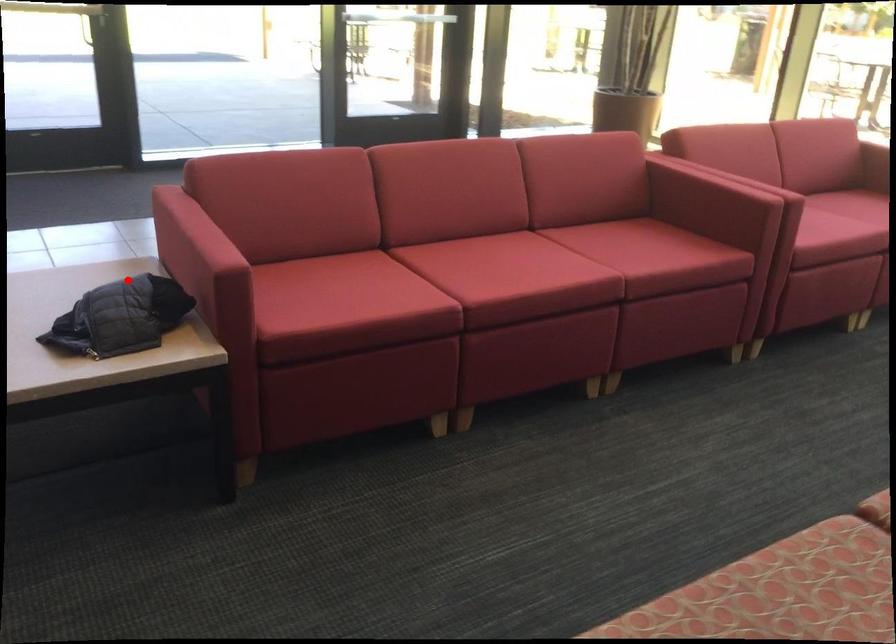
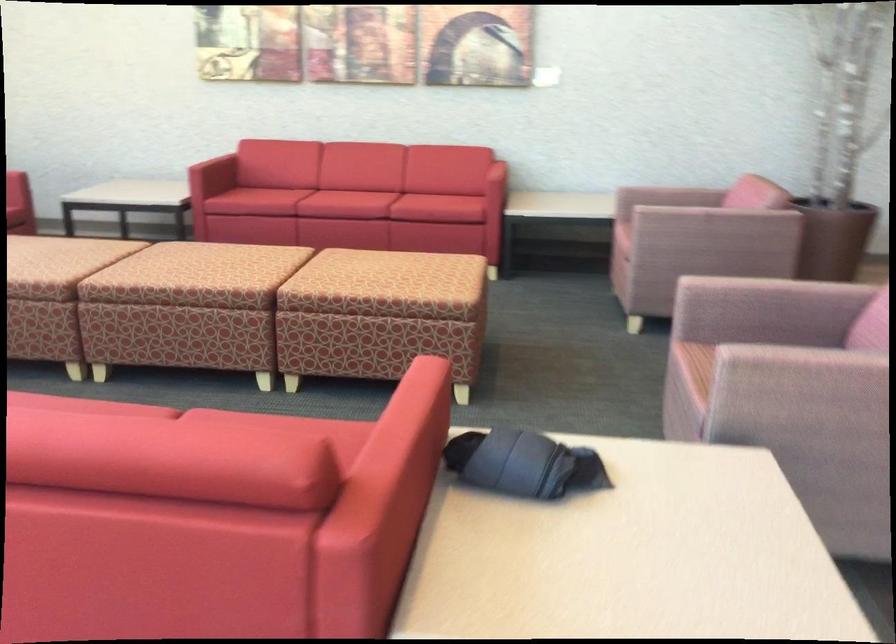
Find the pixel in the second image that matches the highlighted location in the first image.

(522, 464)